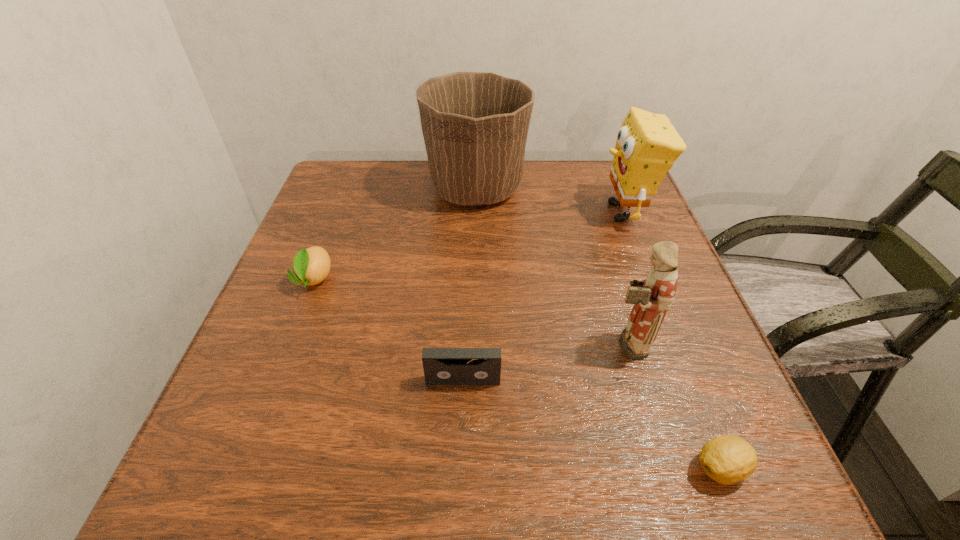
You are a GUI agent. You are given a task and a screenshot of the screen. Output one action in this format:
    pyautogui.click(x=<x>, y=<y>)
    Task: Click on the vacant space located 0.130m on the face of the sponge
    This screenshot has width=960, height=540.
    Given the screenshot: What is the action you would take?
    pyautogui.click(x=543, y=212)

Where is `free point located on the face of the sponge`? The image size is (960, 540). free point located on the face of the sponge is located at coordinates (531, 212).

Find the location of `vacant space located on the front-facing side of the figurine`. vacant space located on the front-facing side of the figurine is located at coordinates (482, 344).

This screenshot has height=540, width=960. In order to click on free region located on the front-facing side of the figurine in this screenshot , I will do `click(386, 344)`.

Where is `vacant space located 0.390m on the front-facing side of the figurine`? The image size is (960, 540). vacant space located 0.390m on the front-facing side of the figurine is located at coordinates (386, 344).

At what (x,y) coordinates should I click in order to perform the action: click on free spot located with leaves positioned above the left lemon. Please return your answer as a coordinate pair (x, y). Looking at the image, I should click on click(249, 449).

The height and width of the screenshot is (540, 960). Find the location of `blank space located at the stem end of the nearest object`. blank space located at the stem end of the nearest object is located at coordinates (537, 468).

Identify the location of vacant space situated at the stem end of the nearest object. This screenshot has width=960, height=540. (467, 468).

This screenshot has height=540, width=960. Find the location of `vacant area located 0.340m at the stem end of the nearest object`. vacant area located 0.340m at the stem end of the nearest object is located at coordinates (452, 468).

The width and height of the screenshot is (960, 540). What are the coordinates of `flowerpot present at the far edge` in the screenshot? It's located at [475, 124].